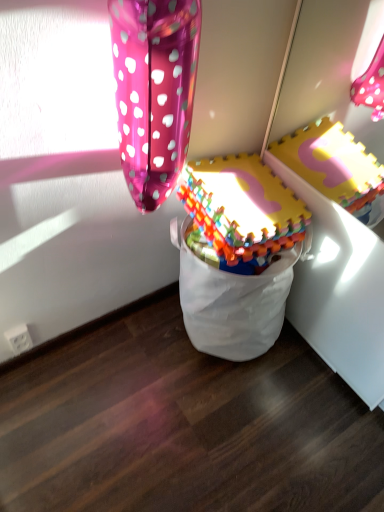
Describe the element at coordinates (240, 213) in the screenshot. The width and height of the screenshot is (384, 512). I see `multicolored plastic blocks at center` at that location.

The width and height of the screenshot is (384, 512). I want to click on multicolored plastic blocks at center, so click(x=240, y=213).

At what (x,y) coordinates should I click in order to perform the action: click on glossy metallic balloon at upper left. Please return your answer as a coordinate pair (x, y). The height and width of the screenshot is (512, 384). Looking at the image, I should click on (154, 91).

Describe the element at coordinates (154, 91) in the screenshot. I see `glossy metallic balloon at upper left` at that location.

Where is `multicolored plastic blocks at center`? This screenshot has width=384, height=512. multicolored plastic blocks at center is located at coordinates (240, 213).

In the image, is glossy metallic balloon at upper left on the left side or the right side of multicolored plastic blocks at center?

Clearly, glossy metallic balloon at upper left is on the left of multicolored plastic blocks at center in the image.

Which object is more forward, glossy metallic balloon at upper left or multicolored plastic blocks at center?

glossy metallic balloon at upper left is closer to the camera.

Between point (189, 23) and point (202, 174), which one is positioned in front?

Positioned in front is point (189, 23).

From the image's perspective, which object appears higher, glossy metallic balloon at upper left or multicolored plastic blocks at center?

glossy metallic balloon at upper left appears higher in the image.

From a real-world perspective, is glossy metallic balloon at upper left located higher than multicolored plastic blocks at center?

Correct, in the physical world, glossy metallic balloon at upper left is higher than multicolored plastic blocks at center.

Which of these two, glossy metallic balloon at upper left or multicolored plastic blocks at center, is thinner?

With smaller width is glossy metallic balloon at upper left.

Can you confirm if glossy metallic balloon at upper left is taller than multicolored plastic blocks at center?

Correct, glossy metallic balloon at upper left is much taller as multicolored plastic blocks at center.

Based on the photo, considering the relative sizes of glossy metallic balloon at upper left and multicolored plastic blocks at center in the image provided, is glossy metallic balloon at upper left smaller than multicolored plastic blocks at center?

Indeed, glossy metallic balloon at upper left has a smaller size compared to multicolored plastic blocks at center.

Is glossy metallic balloon at upper left spatially inside multicolored plastic blocks at center, or outside of it?

glossy metallic balloon at upper left cannot be found inside multicolored plastic blocks at center.

Does glossy metallic balloon at upper left touch multicolored plastic blocks at center?

glossy metallic balloon at upper left and multicolored plastic blocks at center are clearly separated.

Does glossy metallic balloon at upper left turn towards multicolored plastic blocks at center?

→ No, glossy metallic balloon at upper left does not turn towards multicolored plastic blocks at center.

How different are the orientations of glossy metallic balloon at upper left and multicolored plastic blocks at center in degrees?

They differ by 8.09 degrees in their facing directions.

How far apart are glossy metallic balloon at upper left and multicolored plastic blocks at center?

A distance of 12.00 inches exists between glossy metallic balloon at upper left and multicolored plastic blocks at center.

This screenshot has height=512, width=384. Identify the location of toy below the glossy metallic balloon at upper left (from the image's perspective). [240, 213].

Which is more to the right, multicolored plastic blocks at center or glossy metallic balloon at upper left?

Positioned to the right is multicolored plastic blocks at center.

Is multicolored plastic blocks at center further to camera compared to glossy metallic balloon at upper left?

That is True.

Which is farther, (246, 227) or (128, 120)?

The point (246, 227) is farther.

From the image's perspective, would you say multicolored plastic blocks at center is shown under glossy metallic balloon at upper left?

Indeed, from the image's perspective, multicolored plastic blocks at center is shown beneath glossy metallic balloon at upper left.

From a real-world perspective, is multicolored plastic blocks at center beneath glossy metallic balloon at upper left?

Yes.

Between multicolored plastic blocks at center and glossy metallic balloon at upper left, which one has smaller width?

With smaller width is glossy metallic balloon at upper left.

Is multicolored plastic blocks at center taller than glossy metallic balloon at upper left?

No.

Is multicolored plastic blocks at center bigger than glossy metallic balloon at upper left?

Correct, multicolored plastic blocks at center is larger in size than glossy metallic balloon at upper left.

Is multicolored plastic blocks at center outside of glossy metallic balloon at upper left?

Yes, multicolored plastic blocks at center is not within glossy metallic balloon at upper left.

Is multicolored plastic blocks at center positioned far away from glossy metallic balloon at upper left?

Actually, multicolored plastic blocks at center and glossy metallic balloon at upper left are a little close together.

Is glossy metallic balloon at upper left at the back of multicolored plastic blocks at center?

No, multicolored plastic blocks at center is not facing away from glossy metallic balloon at upper left.

How many degrees apart are the facing directions of multicolored plastic blocks at center and glossy metallic balloon at upper left?

8.09 degrees separate the facing orientations of multicolored plastic blocks at center and glossy metallic balloon at upper left.

Locate an element on the screen. toy below the glossy metallic balloon at upper left (from a real-world perspective) is located at coordinates (240, 213).

Locate an element on the screen. The width and height of the screenshot is (384, 512). balloon positioned vertically above the multicolored plastic blocks at center (from a real-world perspective) is located at coordinates (154, 91).

The width and height of the screenshot is (384, 512). I want to click on balloon that appears in front of the multicolored plastic blocks at center, so click(x=154, y=91).